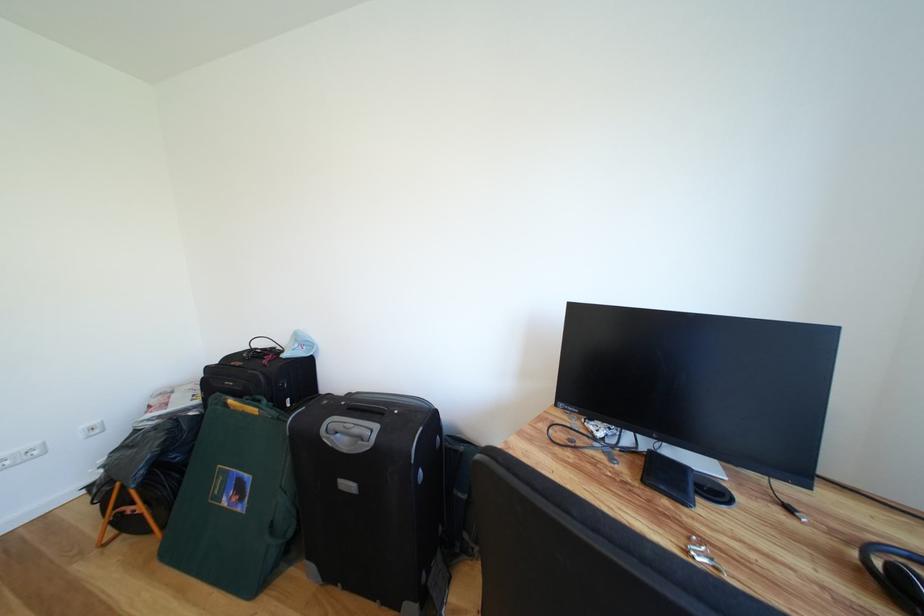
The width and height of the screenshot is (924, 616). I want to click on yellow bag handle, so click(234, 499).